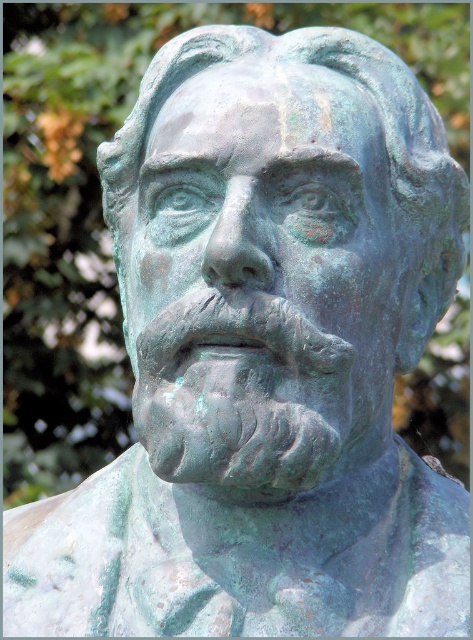
You are an art conservator examining the green patina bust at center and the green patina nose at center. Which object is located higher in the image?

The green patina nose at center is located higher than the green patina bust at center.

You are an art conservator examining the bronze sculpture. You need to determine if the green patina nose at center can fit within the width of the green patina bust at center. Can it?

The green patina bust at center is wider than the green patina nose at center, so yes, the green patina nose at center can fit within the width of the green patina bust at center.

You are an art conservator examining the bronze sculpture. You notice the green patina on both the green patina bust at center and the green patina nose at center. Which of these two objects is positioned more to the right in the image?

The green patina bust at center is positioned more to the right than the green patina nose at center.